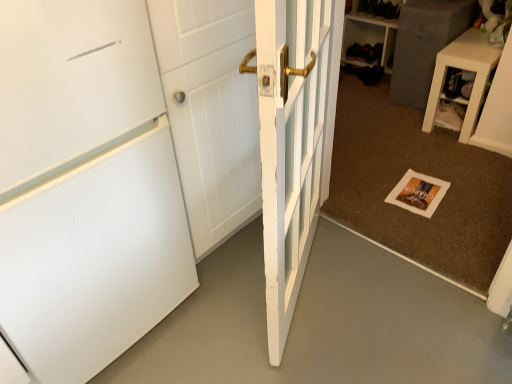
Question: From the image's perspective, is black leather shoe at upper center positioned above or below white matte door at left, marked as the first door in a left-to-right arrangement?

Choices:
 (A) below
 (B) above

Answer: (B)

Question: Is black leather shoe at upper center inside or outside of white matte door at left, which is the 2th door from right to left?

Choices:
 (A) outside
 (B) inside

Answer: (A)

Question: Which object is positioned farthest from the brown textured mat at center?

Choices:
 (A) white matte door at left, marked as the first door in a left-to-right arrangement
 (B) white matte refrigerator at left
 (C) matte gray cabinet at upper right
 (D) white glossy side table at upper right
 (E) black leather shoe at upper center

Answer: (A)

Question: Which is nearer to the white glossy side table at upper right?

Choices:
 (A) white matte door at left, marked as the first door in a left-to-right arrangement
 (B) matte gray cabinet at upper right
 (C) brown textured mat at center
 (D) white matte refrigerator at left
 (E) black leather shoe at upper center

Answer: (B)